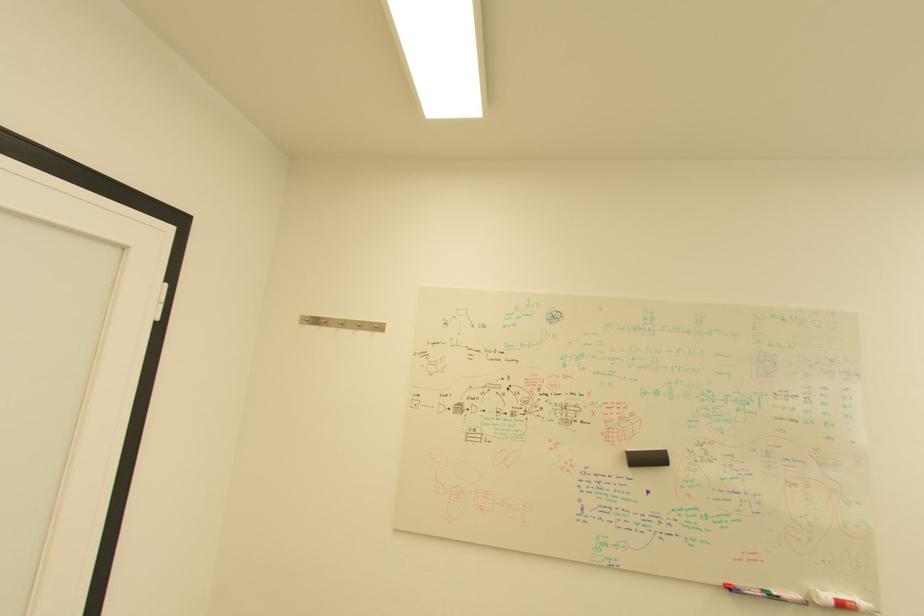
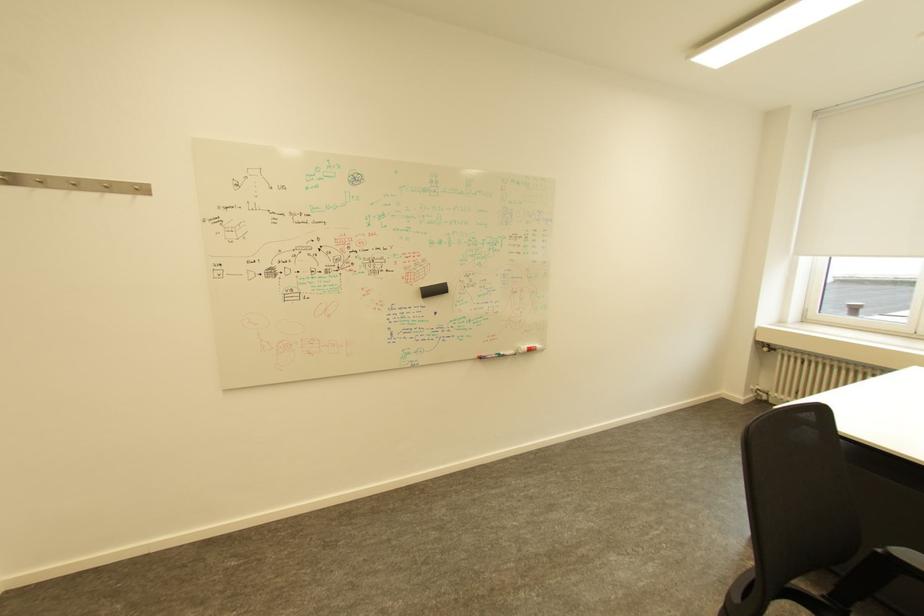
First-person continuous shooting, in which direction is the camera rotating?

The camera rotated toward right-down.